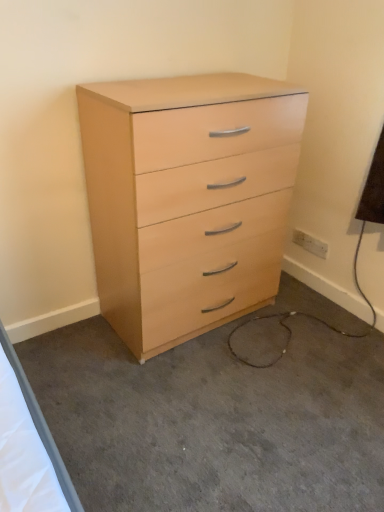
The width and height of the screenshot is (384, 512). In order to click on vacant region in front of light wood/finish chest of drawers at center in this screenshot , I will do `click(193, 401)`.